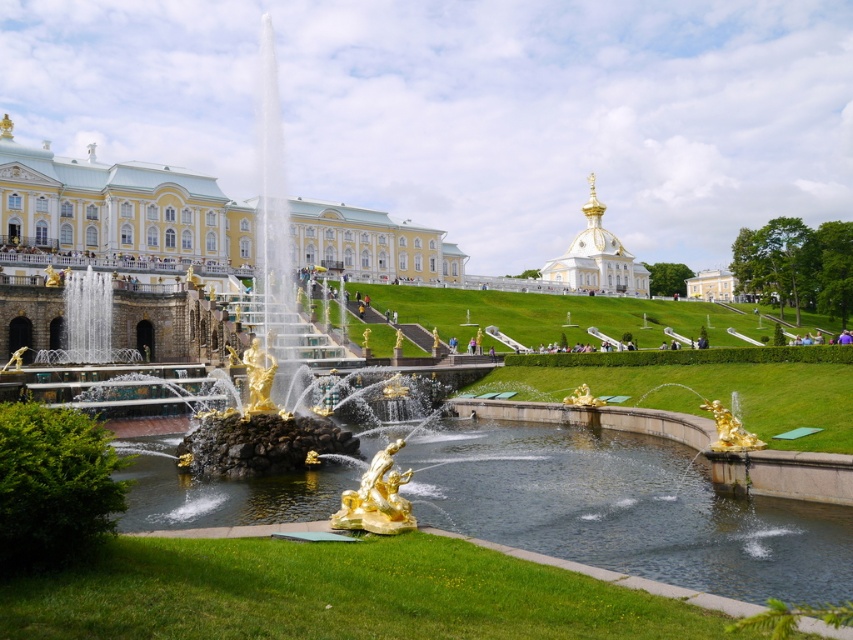
Question: Which of the following is the farthest from the observer?

Choices:
 (A) yellow/smooth/facade at center
 (B) gold plated dome at upper center
 (C) gold metallic statue at center
 (D) gold polished statue at center

Answer: (B)

Question: Observing the image, what is the correct spatial positioning of yellow/smooth/facade at center in reference to gold metallic statue at lower right?

Choices:
 (A) below
 (B) above

Answer: (B)

Question: Does gold polished statue at center lie in front of gold metallic statue at lower right?

Choices:
 (A) yes
 (B) no

Answer: (A)

Question: Which of the following is the closest to the observer?

Choices:
 (A) (97, 250)
 (B) (389, 486)

Answer: (B)

Question: Which of the following is the farthest from the observer?

Choices:
 (A) gold plated dome at upper center
 (B) gold metallic statue at lower right

Answer: (A)

Question: Where is yellow/smooth/facade at center located in relation to gold polished statue at center in the image?

Choices:
 (A) below
 (B) above

Answer: (B)